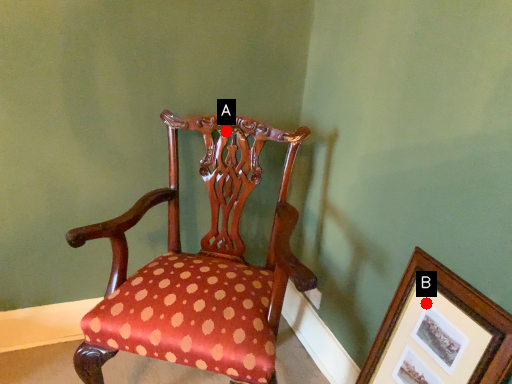
Question: Two points are circled on the image, labeled by A and B beside each circle. Among these points, which one is farthest from the camera?

Choices:
 (A) A is further
 (B) B is further

Answer: (A)